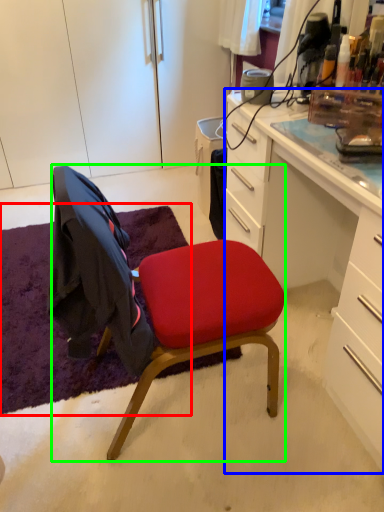
Question: Which is farther away from mat (highlighted by a red box)? desk (highlighted by a blue box) or chair (highlighted by a green box)?

Choices:
 (A) desk
 (B) chair

Answer: (A)